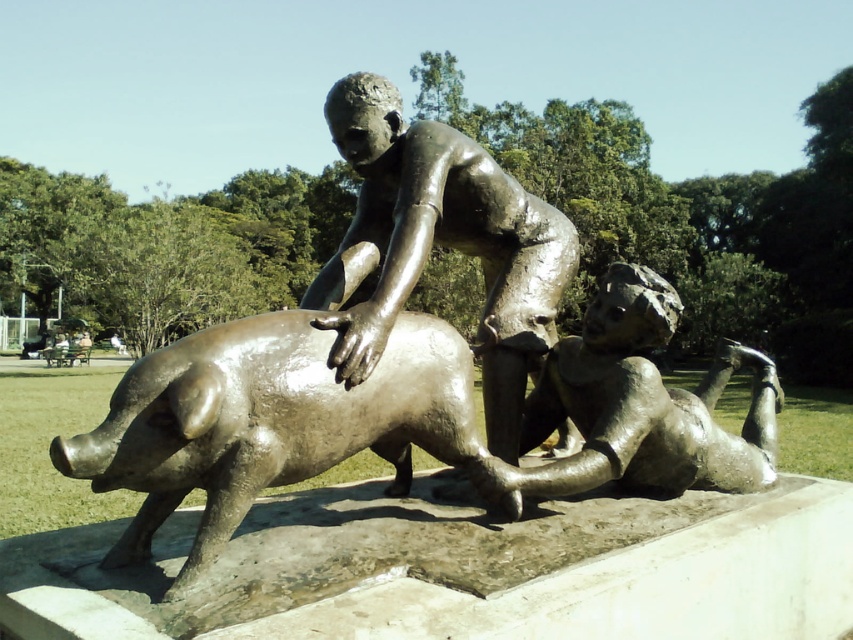
Question: Which point is farther from the camera taking this photo?

Choices:
 (A) (225, 372)
 (B) (364, 150)

Answer: (B)

Question: Which point is closer to the camera taking this photo?

Choices:
 (A) (367, 93)
 (B) (337, 317)
 (C) (683, 410)
 (D) (231, 451)

Answer: (D)

Question: Which point appears farthest from the camera in this image?

Choices:
 (A) (527, 268)
 (B) (474, 440)

Answer: (A)

Question: Is bronze statue at center positioned before bronze figure at lower right?

Choices:
 (A) no
 (B) yes

Answer: (A)

Question: Considering the relative positions of bronze pig at center and bronze statue at center in the image provided, where is bronze pig at center located with respect to bronze statue at center?

Choices:
 (A) above
 (B) below

Answer: (B)

Question: Does shiny bronze pig at center appear on the left side of bronze figure at lower right?

Choices:
 (A) yes
 (B) no

Answer: (A)